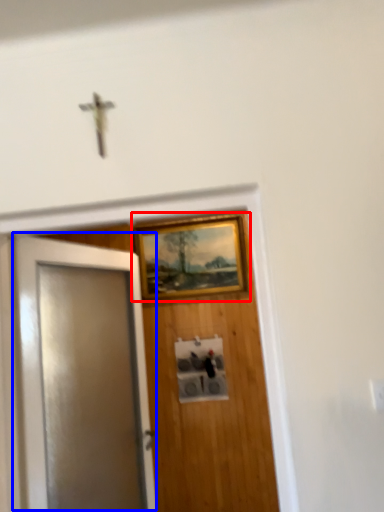
Question: Which object is closer to the camera taking this photo, picture frame (highlighted by a red box) or door (highlighted by a blue box)?

Choices:
 (A) picture frame
 (B) door

Answer: (B)